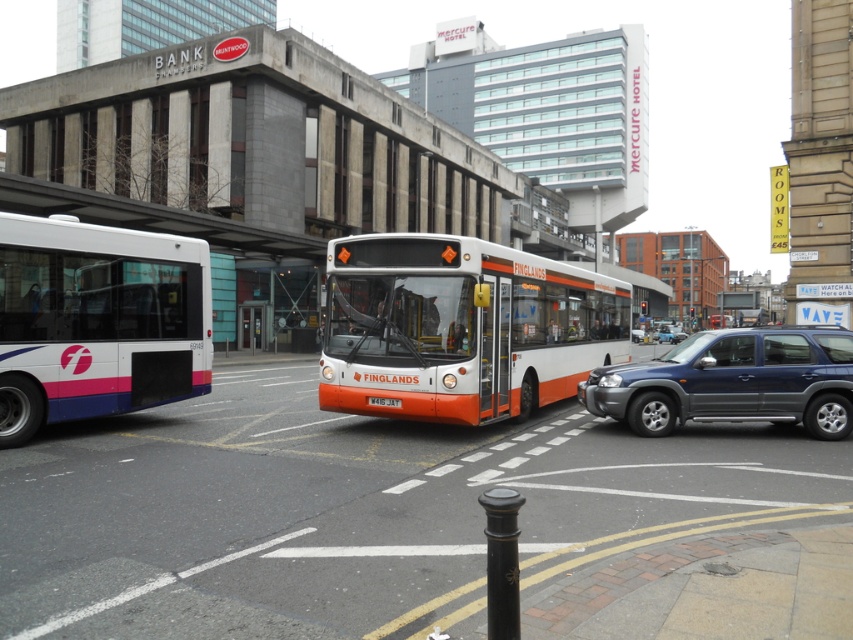
Question: Which object is farther from the camera taking this photo?

Choices:
 (A) white plastic license plate at center
 (B) white matte bus at left
 (C) metallic blue suv at center

Answer: (C)

Question: Does metallic blue suv at center come behind black polished metal pole at center?

Choices:
 (A) no
 (B) yes

Answer: (B)

Question: Does metallic blue suv at center appear on the right side of black polished metal pole at center?

Choices:
 (A) yes
 (B) no

Answer: (A)

Question: Which object is closer to the camera taking this photo?

Choices:
 (A) orange matte bus at center
 (B) white plastic license plate at center
 (C) metallic blue suv at center
 (D) black polished metal pole at center

Answer: (D)

Question: Where is white matte bus at left located in relation to black polished metal pole at center in the image?

Choices:
 (A) right
 (B) left

Answer: (B)

Question: Which object is positioned farthest from the orange matte bus at center?

Choices:
 (A) metallic blue suv at center
 (B) white matte bus at left
 (C) white plastic license plate at center
 (D) black polished metal pole at center

Answer: (D)